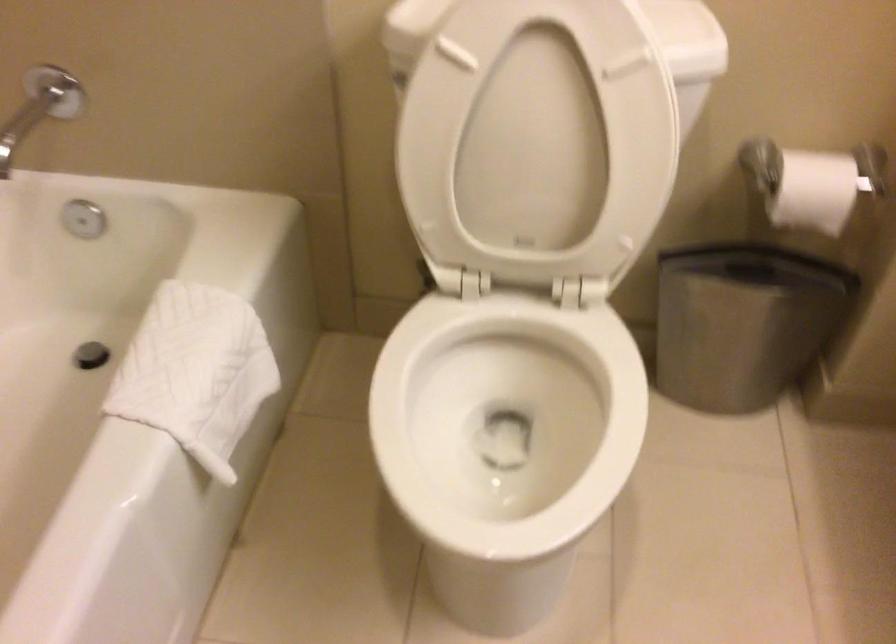
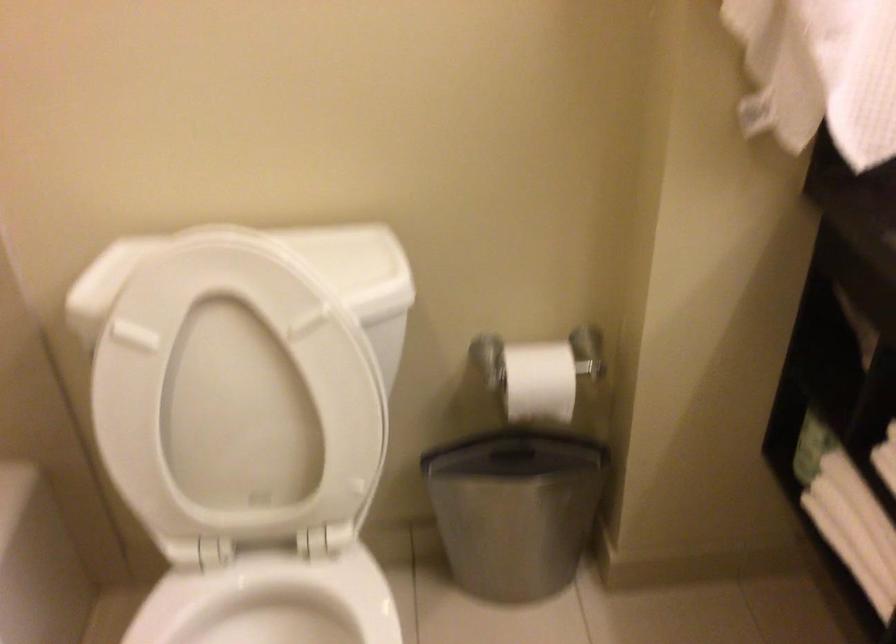
Question: The images are taken continuously from a first-person perspective. In which direction are you moving?

Choices:
 (A) Left
 (B) Right
 (C) Forward
 (D) Backward

Answer: (B)